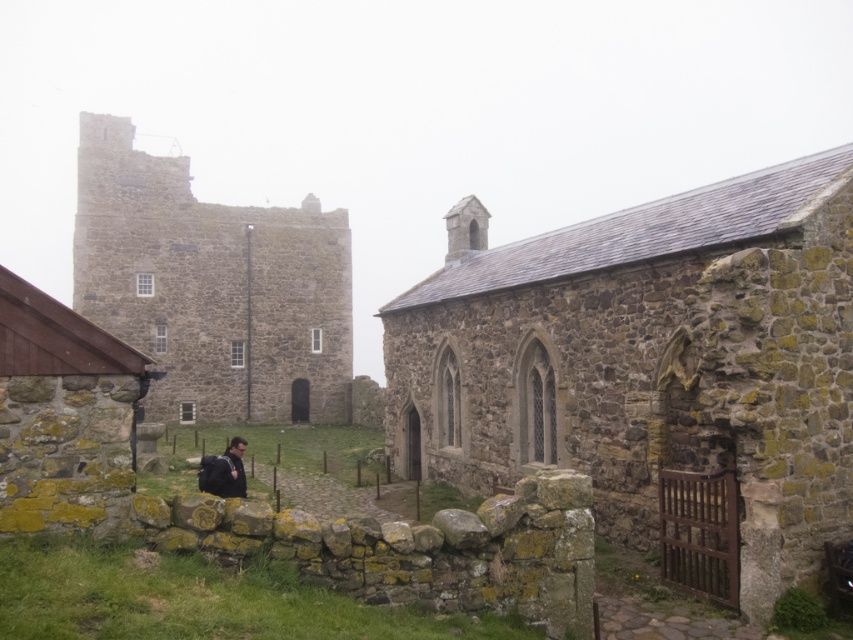
Question: Is the position of gray stone tower at center-left less distant than that of dark blue backpack at lower center?

Choices:
 (A) no
 (B) yes

Answer: (A)

Question: Among these points, which one is farthest from the camera?

Choices:
 (A) (230, 449)
 (B) (161, 164)

Answer: (B)

Question: Among these objects, which one is nearest to the camera?

Choices:
 (A) dark blue backpack at lower center
 (B) gray stone tower at center-left

Answer: (A)

Question: Estimate the real-world distances between objects in this image. Which object is farther from the rustic stone church at center?

Choices:
 (A) dark blue backpack at lower center
 (B) gray stone tower at center-left

Answer: (B)

Question: Is rustic stone church at center to the right of gray stone tower at center-left from the viewer's perspective?

Choices:
 (A) no
 (B) yes

Answer: (B)

Question: Is the position of rustic stone church at center more distant than that of dark blue backpack at lower center?

Choices:
 (A) no
 (B) yes

Answer: (A)